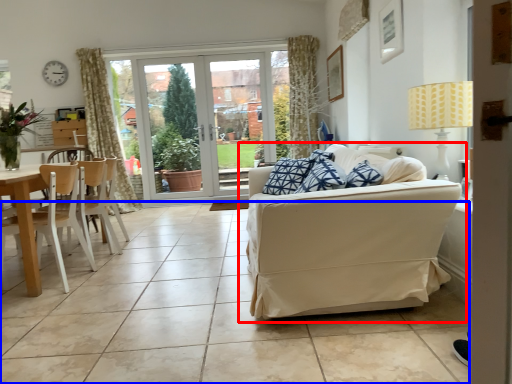
Question: Which of the following is the closest to the observer, studio couch (highlighted by a red box) or ceramic tile (highlighted by a blue box)?

Choices:
 (A) studio couch
 (B) ceramic tile

Answer: (B)